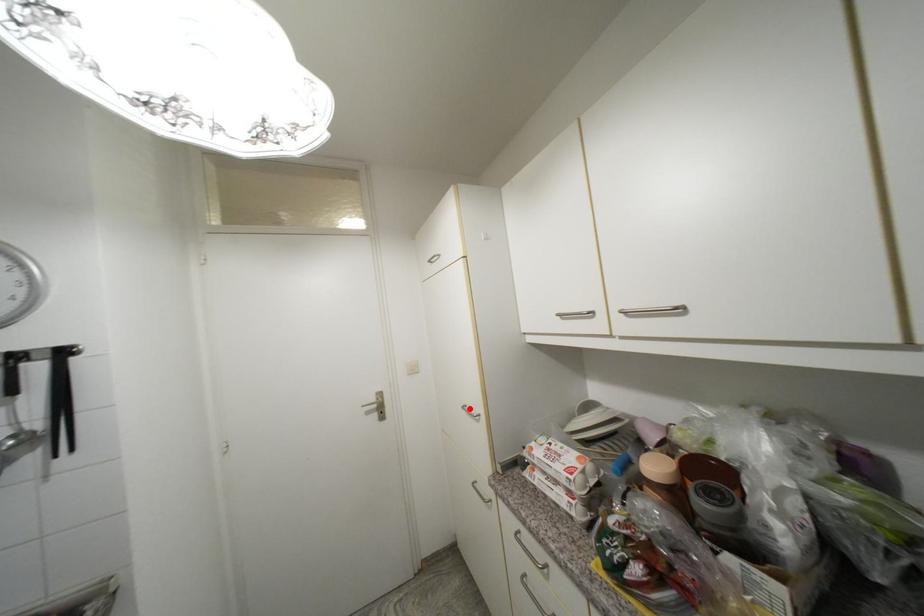
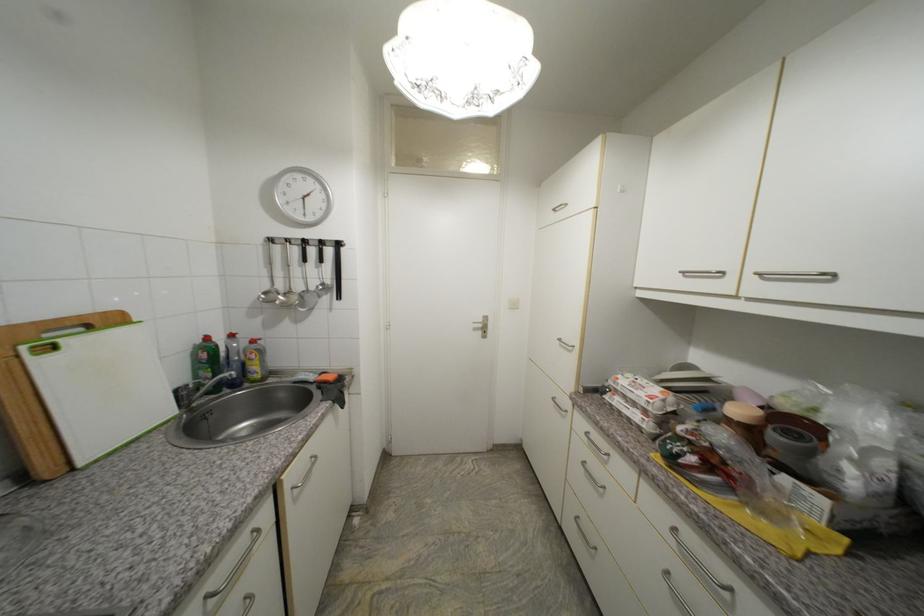
The point at the highlighted location is marked in the first image. Where is the corresponding point in the second image?

(565, 341)